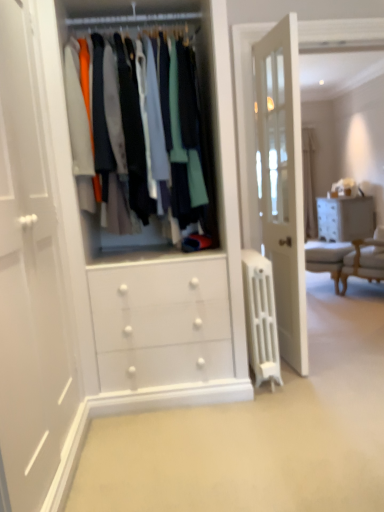
Find the location of `free location in front of white painted radiator at center`. free location in front of white painted radiator at center is located at coordinates (275, 407).